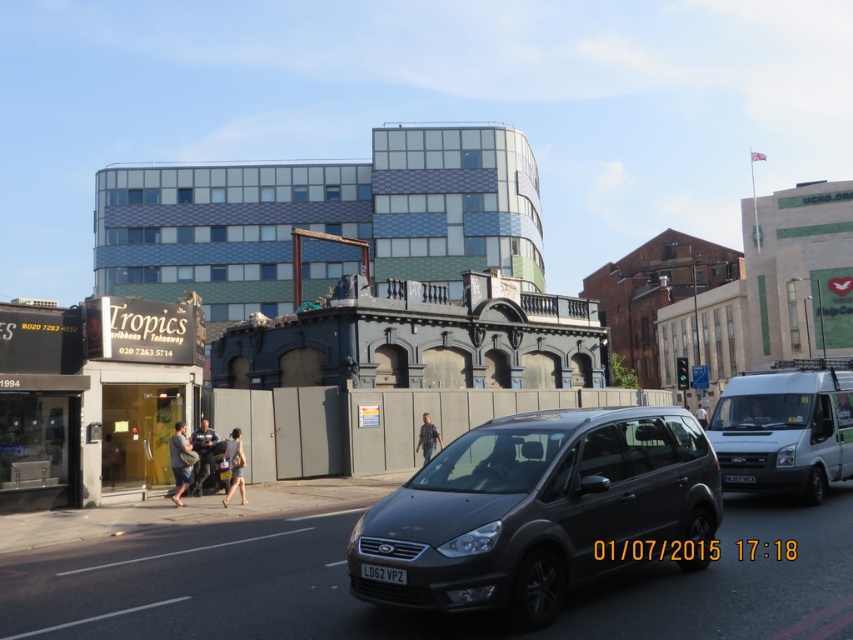
You are a delivery driver needing to park your vehicle in a parking spot that is 2.5 meters wide. You observe the matte black van at center and the white matte van at right. Which vehicle, if either, would fit better in the parking spot based on their widths?

The white matte van at right would fit better in the 2.5 meter parking spot since the matte black van at center might be wider than the white matte van at right.

You are standing on the sidewalk and see the matte black van at center approaching you on the road. If the van is moving at 15 mph, how many seconds will it take for the van to reach you?

The matte black van at center is 20.32 feet away from the viewer. At 15 mph, converting that to feet per second gives approximately 22 feet per second. Dividing the distance by speed yields roughly 0.92 seconds. Therefore, the van will reach the viewer in about 1 second.

You are a delivery driver who needs to park your vehicle in a space that can accommodate both the matte black van at center and the white matte van at right. Based on the scene, which van requires a longer parking space?

The white matte van at right requires a longer parking space because it is taller than the matte black van at center.